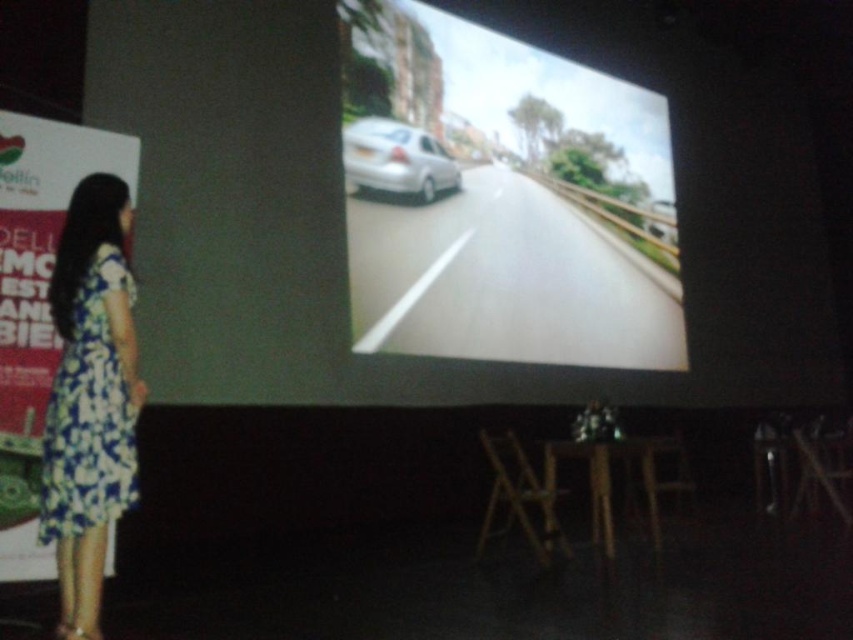
You are an event planner standing in the presentation room. You need to place a 2.5 meter long banner between the metallic silver car at center and the floral fabric dress at left. Will there be enough space to place the banner without overlapping either object?

The metallic silver car at center and floral fabric dress at left are 3.83 meters apart. Since the banner is 2.5 meters long, there is sufficient space to place it between them without overlapping either object.

You are organizing a presentation and need to place a small plant between the metallic silver car at center and the wooden stool at lower center. Considering their sizes, which object should the plant be closer to?

The metallic silver car at center is wider than the wooden stool at lower center. Therefore, the plant should be placed closer to the wooden stool at lower center to maintain balance between the two objects.

You are an event planner organizing a car exhibition. You have a large screen where the metallic silver car at center is displayed and a presenter wearing the floral fabric dress at left. Which object in the scene is larger in size?

The metallic silver car at center is bigger than the floral fabric dress at left, so the metallic silver car at center is larger in size.